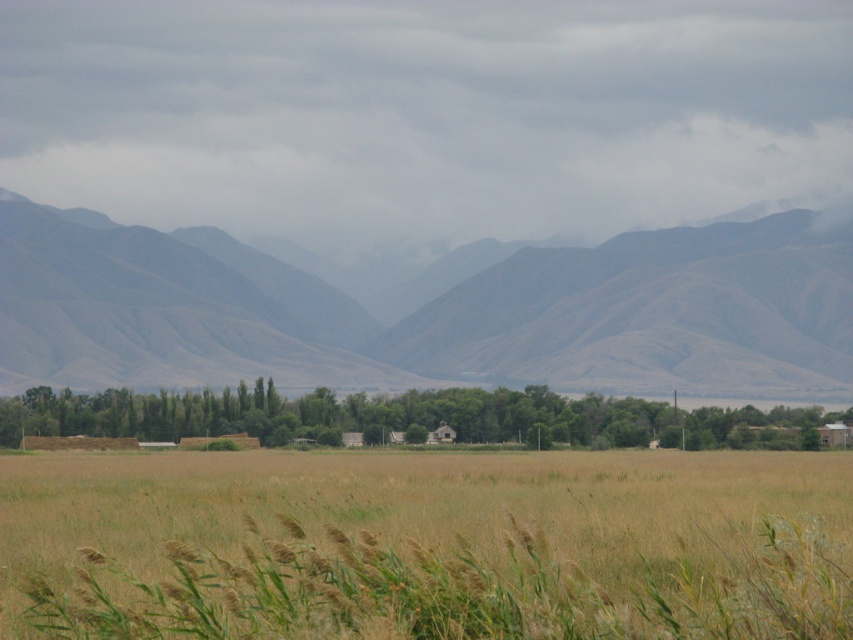
You are a hiker trying to determine the best path to reach the mountains in the background. You have two options to cross the landscape. One path goes through the brown grassland at center, and the other goes through the green leafy trees at center. Which path would require climbing over higher obstacles?

The path through the brown grassland at center would require climbing over higher obstacles since the brown grassland at center has a greater height compared to the green leafy trees at center.

You are a hiker trying to determine the best path to reach the mountains in the background. You have two options to choose from. One path goes through the brown grassland at center, and the other goes through the green leafy trees at center. Which path would you choose based on the size of the obstacles?

The brown grassland at center has a larger size compared to the green leafy trees at center. Therefore, the path through the green leafy trees at center would be shorter and easier to navigate.